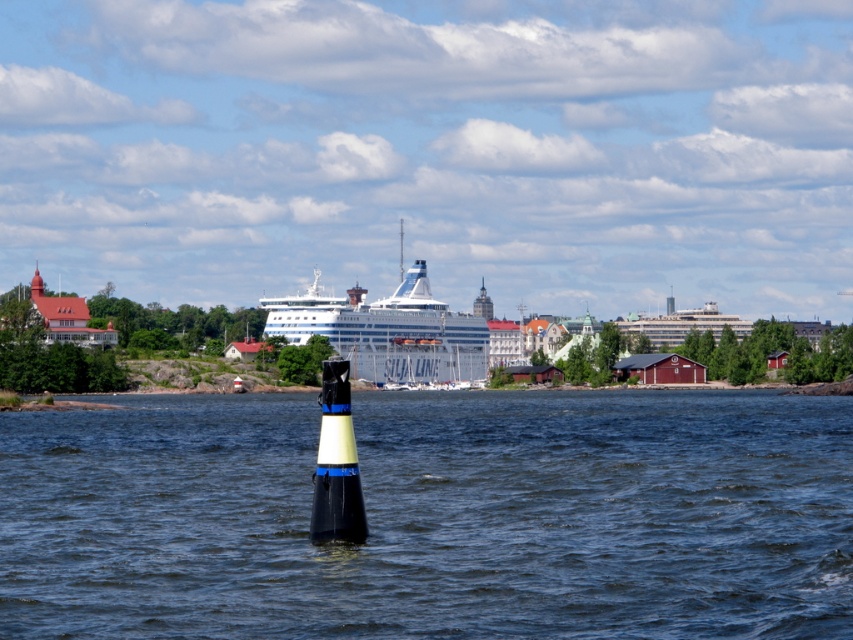
Question: Can you confirm if black rubber buoy at center is thinner than white glossy cruise ship at center?

Choices:
 (A) no
 (B) yes

Answer: (A)

Question: Which object appears farthest from the camera in this image?

Choices:
 (A) black rubber buoy at center
 (B) white glossy cruise ship at center

Answer: (B)

Question: Is black rubber buoy at center below white glossy cruise ship at center?

Choices:
 (A) no
 (B) yes

Answer: (B)

Question: Is black rubber buoy at center behind white glossy cruise ship at center?

Choices:
 (A) no
 (B) yes

Answer: (A)

Question: Which of the following is the farthest from the observer?

Choices:
 (A) (374, 339)
 (B) (525, 628)

Answer: (A)

Question: Which object is closer to the camera taking this photo?

Choices:
 (A) black rubber buoy at center
 (B) white glossy cruise ship at center

Answer: (A)